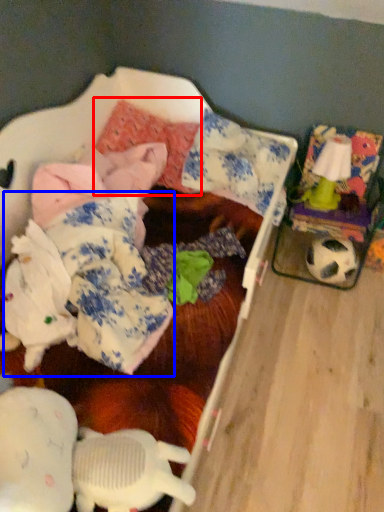
Question: Which object is closer to the camera taking this photo, pillow (highlighted by a red box) or clothing (highlighted by a blue box)?

Choices:
 (A) pillow
 (B) clothing

Answer: (B)